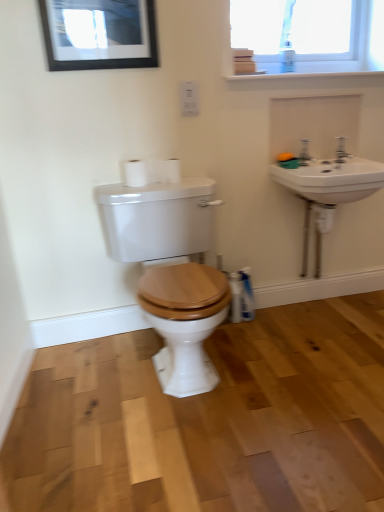
The image size is (384, 512). Identify the location of white plastic bottle at lower right. (246, 295).

This screenshot has width=384, height=512. Describe the element at coordinates (285, 157) in the screenshot. I see `orange matte soap at upper right` at that location.

Identify the location of white ceramic sink at upper right. This screenshot has height=512, width=384. (304, 153).

What do you see at coordinates (152, 172) in the screenshot? Image resolution: width=384 pixels, height=512 pixels. I see `white matte toilet paper at upper center, which appears as the 2th toilet paper when viewed from the right` at bounding box center [152, 172].

Describe the element at coordinates (331, 177) in the screenshot. Image resolution: width=384 pixels, height=512 pixels. I see `white ceramic sink at upper right` at that location.

Consider the image. Measure the distance between clear glass window at upper right and camera.

1.84 meters.

The image size is (384, 512). Identify the location of white plastic bottle at lower right. (246, 295).

Is wooden toilet seat at center touching white matte toilet paper at upper center, the first toilet paper in the right-to-left sequence?

No, wooden toilet seat at center is not next to white matte toilet paper at upper center, the first toilet paper in the right-to-left sequence.

At what (x,y) coordinates should I click in order to perform the action: click on toilet paper that is the 1st one when counting leftward from the wooden toilet seat at center. Please return your answer as a coordinate pair (x, y). Image resolution: width=384 pixels, height=512 pixels. Looking at the image, I should click on (172, 170).

How much distance is there between wooden toilet seat at center and white matte toilet paper at upper center, the second toilet paper from the left?

They are 17.66 inches apart.

The height and width of the screenshot is (512, 384). I want to click on window that is above the white plastic bottle at lower right (from a real-world perspective), so click(309, 36).

Which is farther from the camera, [330,32] or [245,313]?

Positioned behind is point [330,32].

Considering the sizes of objects clear glass window at upper right and white plastic bottle at lower right in the image provided, who is taller, clear glass window at upper right or white plastic bottle at lower right?

clear glass window at upper right.

From the image's perspective, who appears lower, clear glass window at upper right or white plastic bottle at lower right?

From the image's view, white plastic bottle at lower right is below.

Between matte black picture frame at upper left and white plastic bottle at lower right, which one appears on the right side from the viewer's perspective?

From the viewer's perspective, white plastic bottle at lower right appears more on the right side.

Measure the distance between matte black picture frame at upper left and white plastic bottle at lower right.

matte black picture frame at upper left is 4.09 feet away from white plastic bottle at lower right.

Is matte black picture frame at upper left aimed at white plastic bottle at lower right?

No, matte black picture frame at upper left is not facing towards white plastic bottle at lower right.

Looking at this image, from the image's perspective, would you say matte black picture frame at upper left is shown under white plastic bottle at lower right?

No, from the image's perspective, matte black picture frame at upper left is not below white plastic bottle at lower right.

Which object is positioned more to the left, white matte toilet paper at upper center, which appears as the 2th toilet paper when viewed from the right, or white plastic bottle at lower right?

white matte toilet paper at upper center, which appears as the 2th toilet paper when viewed from the right.

Is white matte toilet paper at upper center, which appears as the first toilet paper when viewed from the left, looking in the opposite direction of white plastic bottle at lower right?

No, white plastic bottle at lower right is not at the back of white matte toilet paper at upper center, which appears as the first toilet paper when viewed from the left.

Is white plastic bottle at lower right completely or partially inside white matte toilet paper at upper center, which appears as the 2th toilet paper when viewed from the right?

No, white plastic bottle at lower right is not a part of white matte toilet paper at upper center, which appears as the 2th toilet paper when viewed from the right.

From the image's perspective, is white matte toilet paper at upper center, which appears as the first toilet paper when viewed from the left, above or below white plastic bottle at lower right?

Based on their image positions, white matte toilet paper at upper center, which appears as the first toilet paper when viewed from the left, is located above white plastic bottle at lower right.

Is silver metallic faucet at upper right oriented away from white plastic bottle at lower right?

silver metallic faucet at upper right is not turned away from white plastic bottle at lower right.

Which object is closer to the camera taking this photo, silver metallic faucet at upper right or white plastic bottle at lower right?

Positioned in front is silver metallic faucet at upper right.

This screenshot has width=384, height=512. Identify the location of tap on the right of white plastic bottle at lower right. (341, 150).

How much distance is there between silver metallic faucet at upper right and white plastic bottle at lower right?

A distance of 31.71 inches exists between silver metallic faucet at upper right and white plastic bottle at lower right.

In order to click on toilet lying on the left of white ceramic sink at upper right in this screenshot , I will do `click(171, 271)`.

From a real-world perspective, who is located higher, white ceramic sink at upper right or wooden toilet seat at center?

white ceramic sink at upper right is physically above.

Could wooden toilet seat at center be considered to be inside white ceramic sink at upper right?

No.

Is point (305, 152) less distant than point (241, 269)?

Yes, point (305, 152) is closer to viewer.

How different are the orientations of white ceramic sink at upper right and white plastic bottle at lower right in degrees?

48.4 degrees.

Is white ceramic sink at upper right smaller than white plastic bottle at lower right?

Correct, white ceramic sink at upper right occupies less space than white plastic bottle at lower right.

Who is taller, white ceramic sink at upper right or white plastic bottle at lower right?

white plastic bottle at lower right.

Where is `toilet located in front of the white matte toilet paper at upper center, the second toilet paper from the left`? The image size is (384, 512). toilet located in front of the white matte toilet paper at upper center, the second toilet paper from the left is located at coordinates (171, 271).

This screenshot has width=384, height=512. There is a white plastic bottle at lower right. Identify the location of window above it (from a real-world perspective). (309, 36).

Which object lies further to the anchor point silver metallic faucet at upper right, orange matte soap at upper right or white matte toilet paper at upper center, the second toilet paper from the left?

white matte toilet paper at upper center, the second toilet paper from the left.

Estimate the real-world distances between objects in this image. Which object is closer to white plastic bottle at lower right, white matte toilet paper at upper center, which appears as the 2th toilet paper when viewed from the right, or white matte toilet paper at upper center, the first toilet paper in the right-to-left sequence?

white matte toilet paper at upper center, the first toilet paper in the right-to-left sequence, lies closer to white plastic bottle at lower right than the other object.

Based on their spatial positions, is orange matte soap at upper right or silver metallic faucet at upper right closer to white ceramic sink at upper right?

Among the two, silver metallic faucet at upper right is located nearer to white ceramic sink at upper right.

Estimate the real-world distances between objects in this image. Which object is closer to white matte toilet paper at upper center, the second toilet paper from the left, white ceramic sink at upper right or white ceramic sink at upper right?

white ceramic sink at upper right.

Which object lies nearer to the anchor point clear glass window at upper right, white matte toilet paper at upper center, the second toilet paper from the left, or white matte toilet paper at upper center, which appears as the 2th toilet paper when viewed from the right?

white matte toilet paper at upper center, which appears as the 2th toilet paper when viewed from the right, is positioned closer to the anchor clear glass window at upper right.

Looking at the image, which one is located further to white ceramic sink at upper right, orange matte soap at upper right or white matte toilet paper at upper center, which appears as the 2th toilet paper when viewed from the right?

The object further to white ceramic sink at upper right is white matte toilet paper at upper center, which appears as the 2th toilet paper when viewed from the right.

Considering their positions, is white ceramic sink at upper right positioned closer to matte black picture frame at upper left than white ceramic sink at upper right?

Based on the image, white ceramic sink at upper right appears to be nearer to matte black picture frame at upper left.

Which object lies further to the anchor point white matte toilet paper at upper center, which appears as the first toilet paper when viewed from the left, white ceramic sink at upper right or clear glass window at upper right?

The object further to white matte toilet paper at upper center, which appears as the first toilet paper when viewed from the left, is clear glass window at upper right.

What are the coordinates of `plumbing fixture between wooden toilet seat at center and orange matte soap at upper right along the z-axis` in the screenshot? It's located at (304, 153).

Identify the location of toilet paper situated between white matte toilet paper at upper center, which appears as the first toilet paper when viewed from the left, and orange matte soap at upper right from left to right. This screenshot has width=384, height=512. (172, 170).

Find the location of a particular element. The width and height of the screenshot is (384, 512). soap that lies between clear glass window at upper right and white ceramic sink at upper right from top to bottom is located at coordinates (285, 157).

Where is `plumbing fixture between clear glass window at upper right and white plastic bottle at lower right vertically`? plumbing fixture between clear glass window at upper right and white plastic bottle at lower right vertically is located at coordinates (304, 153).